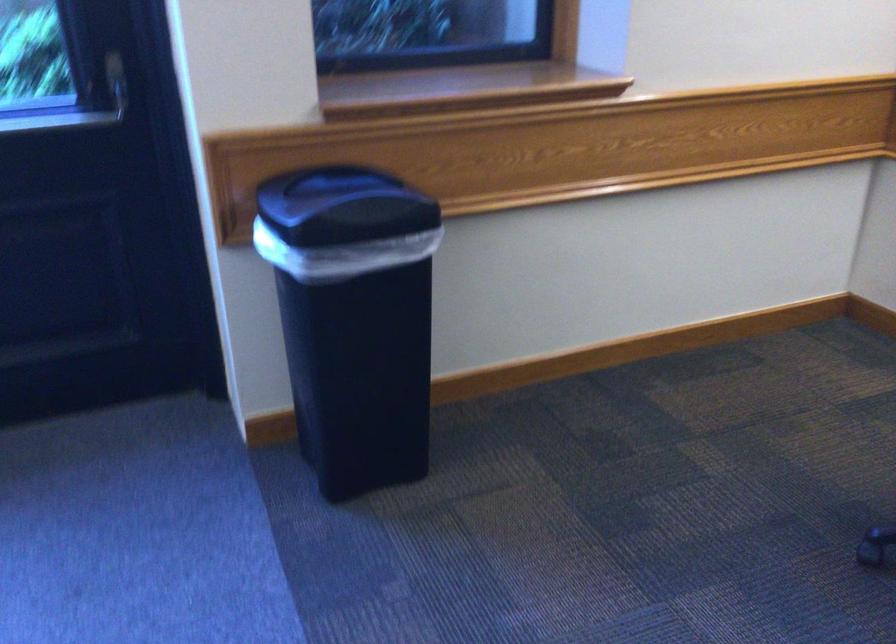
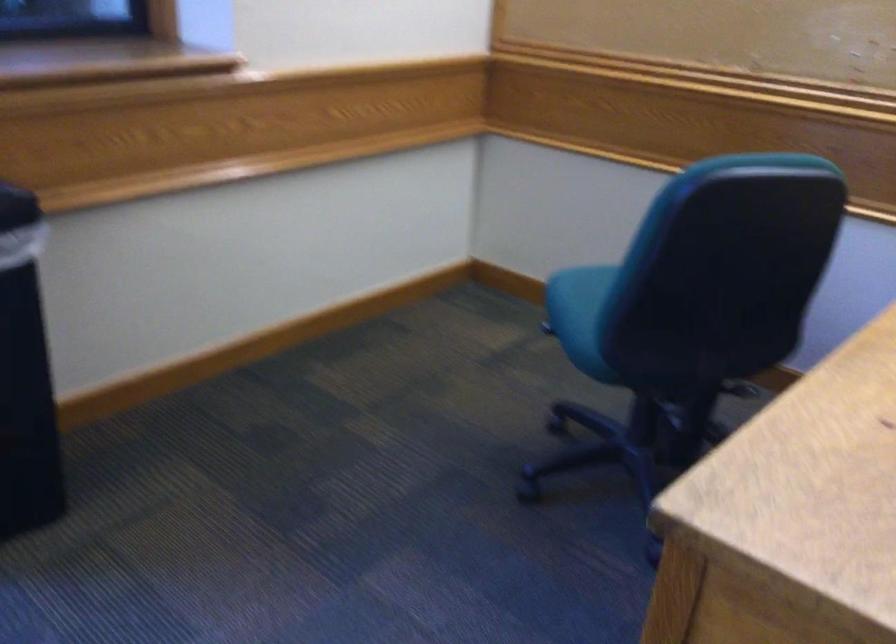
In a continuous first-person perspective shot, in which direction is the camera moving?

The cameraman walked toward left, forward.